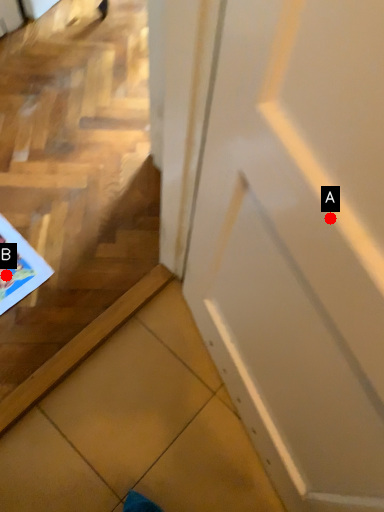
Question: Two points are circled on the image, labeled by A and B beside each circle. Which point is further to the camera?

Choices:
 (A) A is further
 (B) B is further

Answer: (B)